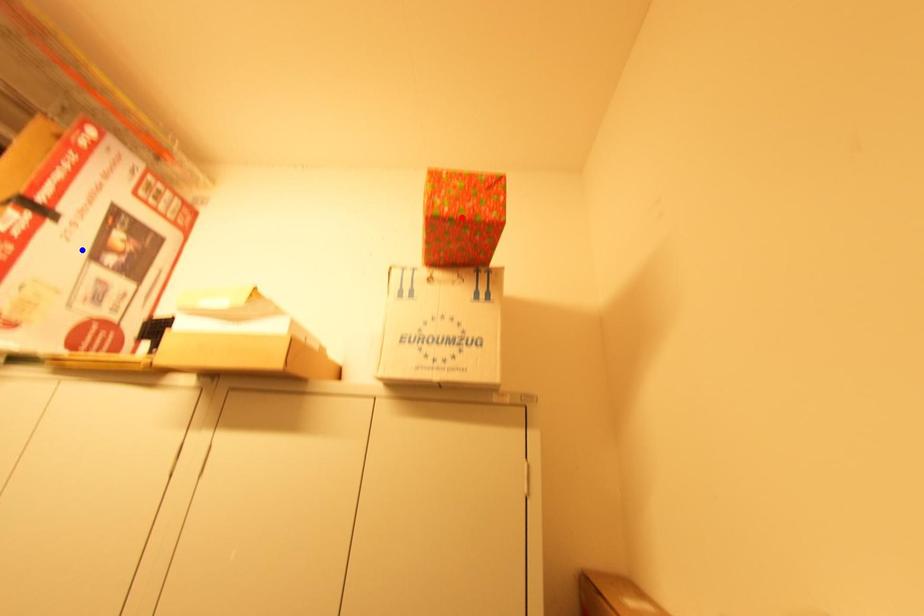
Question: Which of the two points in the image is closer to the camera?

Choices:
 (A) Blue point is closer.
 (B) Red point is closer.

Answer: (B)